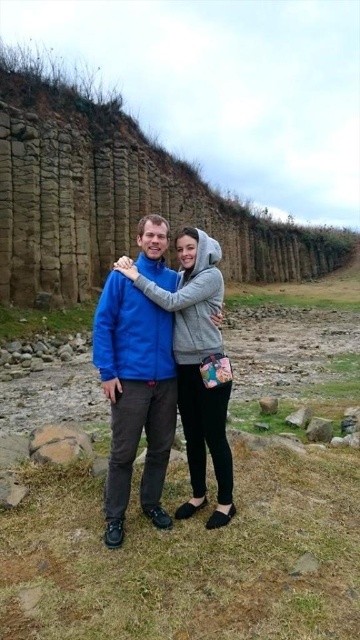
Which of these two, blue fleece jacket at center or gray rough stone at lower right, stands shorter?

gray rough stone at lower right

Is blue fleece jacket at center further to the viewer compared to gray rough stone at lower right?

That is False.

Does point (101, 356) come closer to viewer compared to point (330, 422)?

Yes, point (101, 356) is in front of point (330, 422).

You are a GUI agent. You are given a task and a screenshot of the screen. Output one action in this format:
    pyautogui.click(x=<x>, y=<y>)
    Task: Click on the blue fleece jacket at center
    The image size is (360, 640).
    Given the screenshot: What is the action you would take?
    pyautogui.click(x=135, y=396)